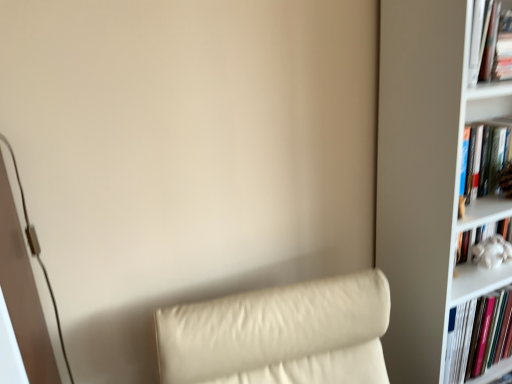
Question: Considering the positions of hardcover book at right, the 1th book in the bottom-to-top sequence, and hardcover book at upper right, marked as the first book in a top-to-bottom arrangement, in the image, is hardcover book at right, the 1th book in the bottom-to-top sequence, wider or thinner than hardcover book at upper right, marked as the first book in a top-to-bottom arrangement,?

Choices:
 (A) thin
 (B) wide

Answer: (B)

Question: From the image's perspective, is hardcover book at right, the 4th book from the top, located above or below hardcover book at upper right, marked as the first book in a top-to-bottom arrangement?

Choices:
 (A) above
 (B) below

Answer: (B)

Question: Which is farther from the hardcover book at right, the second book positioned from the top?

Choices:
 (A) hardcover book at upper right, marked as the first book in a top-to-bottom arrangement
 (B) white fluffy toy at right, the third book from the top
 (C) hardcover book at right, the 1th book in the bottom-to-top sequence
 (D) white matte bookcase at right

Answer: (C)

Question: Based on their relative distances, which object is farther from the white fluffy toy at right, the third book from the top?

Choices:
 (A) white matte bookcase at right
 (B) hardcover book at upper right, marked as the first book in a top-to-bottom arrangement
 (C) hardcover book at right, the third book in the bottom-to-top sequence
 (D) hardcover book at right, the 4th book from the top

Answer: (B)